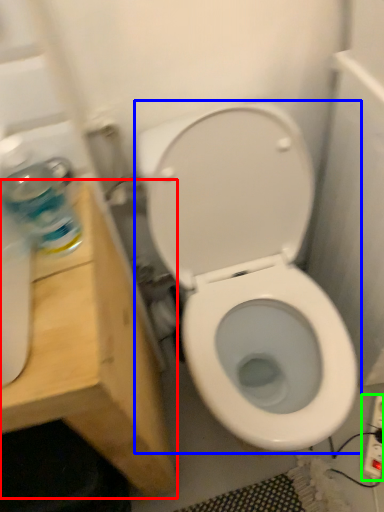
Question: Considering the real-world distances, which object is farthest from vanity (highlighted by a red box)? toilet (highlighted by a blue box) or electric outlet (highlighted by a green box)?

Choices:
 (A) toilet
 (B) electric outlet

Answer: (B)